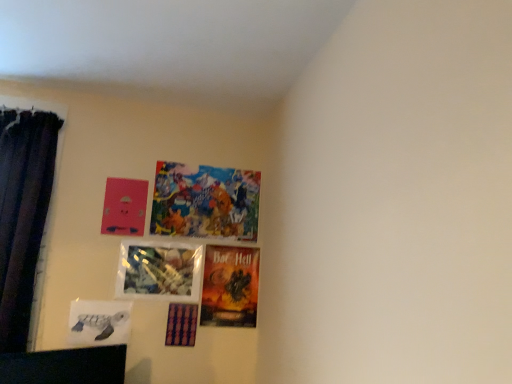
Question: From the image's perspective, does purple glossy picture frame at lower center, which is the 1th picture frame in bottom-to-top order, appear lower than dark velvet curtain at left?

Choices:
 (A) no
 (B) yes

Answer: (B)

Question: Could dark velvet curtain at left be considered to be inside purple glossy picture frame at lower center, which is the 1th picture frame in bottom-to-top order?

Choices:
 (A) no
 (B) yes

Answer: (A)

Question: Considering the relative sizes of purple glossy picture frame at lower center, which is the 1th picture frame in bottom-to-top order, and dark velvet curtain at left in the image provided, is purple glossy picture frame at lower center, which is the 1th picture frame in bottom-to-top order, taller than dark velvet curtain at left?

Choices:
 (A) yes
 (B) no

Answer: (B)

Question: Are purple glossy picture frame at lower center, which is counted as the 6th picture frame, starting from the top, and dark velvet curtain at left located far from each other?

Choices:
 (A) yes
 (B) no

Answer: (B)

Question: From a real-world perspective, is purple glossy picture frame at lower center, which is the 1th picture frame in bottom-to-top order, beneath dark velvet curtain at left?

Choices:
 (A) yes
 (B) no

Answer: (A)

Question: From a real-world perspective, is purple glossy picture frame at lower center, which is the 1th picture frame in bottom-to-top order, over dark velvet curtain at left?

Choices:
 (A) yes
 (B) no

Answer: (B)

Question: Can you confirm if matte pink picture frame at upper left, placed as the fifth picture frame when sorted from bottom to top, is bigger than colorful paper collage at upper center, positioned as the first picture frame in top-to-bottom order?

Choices:
 (A) no
 (B) yes

Answer: (A)

Question: Does matte pink picture frame at upper left, placed as the fifth picture frame when sorted from bottom to top, have a smaller size compared to colorful paper collage at upper center, positioned as the first picture frame in top-to-bottom order?

Choices:
 (A) no
 (B) yes

Answer: (B)

Question: Is the depth of matte pink picture frame at upper left, acting as the second picture frame starting from the top, greater than that of colorful paper collage at upper center, which ranks as the 6th picture frame in bottom-to-top order?

Choices:
 (A) no
 (B) yes

Answer: (A)

Question: From the image's perspective, is matte pink picture frame at upper left, placed as the fifth picture frame when sorted from bottom to top, under colorful paper collage at upper center, which ranks as the 6th picture frame in bottom-to-top order?

Choices:
 (A) yes
 (B) no

Answer: (A)

Question: Considering the relative sizes of matte pink picture frame at upper left, placed as the fifth picture frame when sorted from bottom to top, and colorful paper collage at upper center, which ranks as the 6th picture frame in bottom-to-top order, in the image provided, is matte pink picture frame at upper left, placed as the fifth picture frame when sorted from bottom to top, shorter than colorful paper collage at upper center, which ranks as the 6th picture frame in bottom-to-top order,?

Choices:
 (A) yes
 (B) no

Answer: (A)

Question: Is matte pink picture frame at upper left, placed as the fifth picture frame when sorted from bottom to top, thinner than colorful paper collage at upper center, positioned as the first picture frame in top-to-bottom order?

Choices:
 (A) no
 (B) yes

Answer: (B)

Question: Is matte pink picture frame at upper left, placed as the fifth picture frame when sorted from bottom to top, inside matte cardboard poster at center, positioned as the 3th picture frame in bottom-to-top order?

Choices:
 (A) yes
 (B) no

Answer: (B)